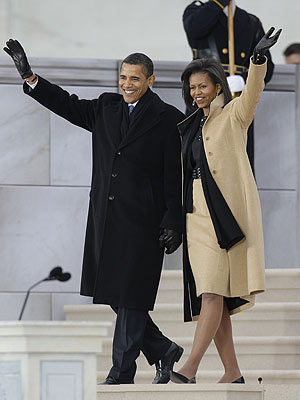
I want to click on gray wall, so click(99, 19).